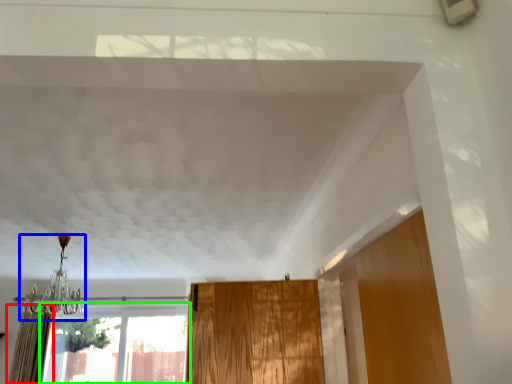
Question: Estimate the real-world distances between objects in this image. Which object is closer to curtain (highlighted by a red box), light fixture (highlighted by a blue box) or window (highlighted by a green box)?

Choices:
 (A) light fixture
 (B) window

Answer: (A)